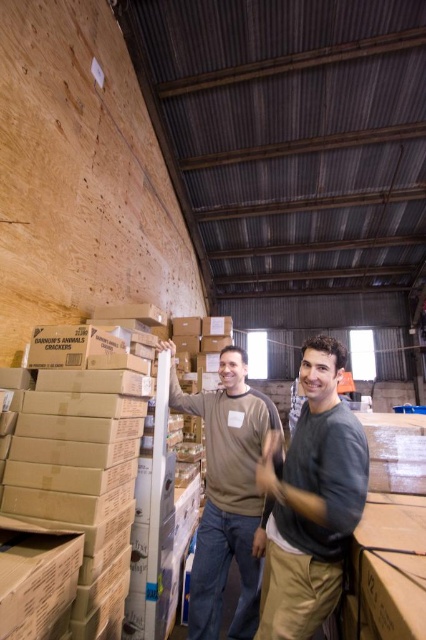
Question: Is dark gray cotton shirt at center bigger than brown cotton shirt at center?

Choices:
 (A) yes
 (B) no

Answer: (B)

Question: Which of the following is the closest to the observer?

Choices:
 (A) brown cotton shirt at center
 (B) dark gray cotton shirt at center

Answer: (B)

Question: Does dark gray cotton shirt at center appear over brown cotton shirt at center?

Choices:
 (A) no
 (B) yes

Answer: (B)

Question: Which of the following is the closest to the observer?

Choices:
 (A) (348, 454)
 (B) (256, 406)

Answer: (A)

Question: Among these points, which one is nearest to the camera?

Choices:
 (A) (339, 371)
 (B) (213, 403)

Answer: (A)

Question: Is dark gray cotton shirt at center closer to camera compared to brown cotton shirt at center?

Choices:
 (A) no
 (B) yes

Answer: (B)